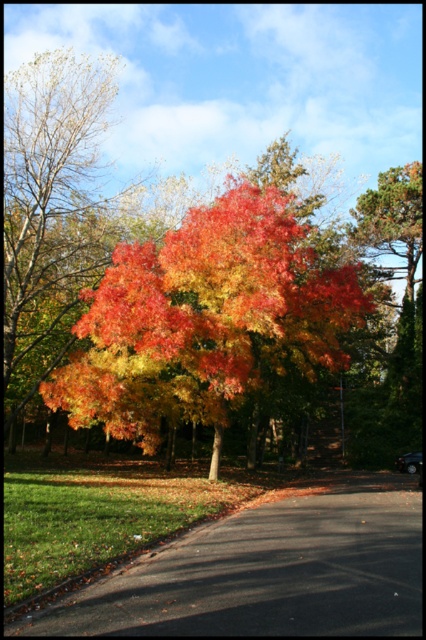
Is vivid autumn leaves at center above black asphalt road at lower center?

Yes.

Which is in front, point (314, 328) or point (330, 557)?

Positioned in front is point (330, 557).

You are a GUI agent. You are given a task and a screenshot of the screen. Output one action in this format:
    pyautogui.click(x=<x>, y=<y>)
    Task: Click on the vivid autumn leaves at center
    This screenshot has height=640, width=426.
    Given the screenshot: What is the action you would take?
    pyautogui.click(x=204, y=320)